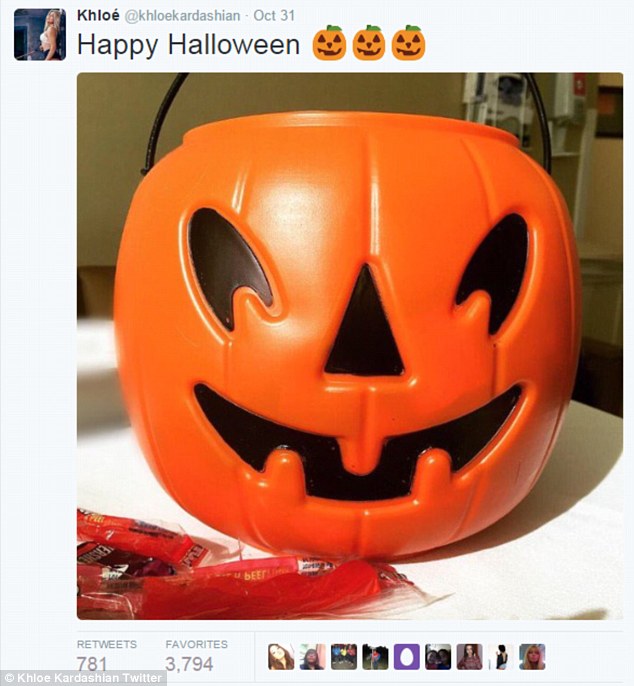
Locate an element on the screen. Image resolution: width=634 pixels, height=686 pixels. tile floor is located at coordinates (600, 317).